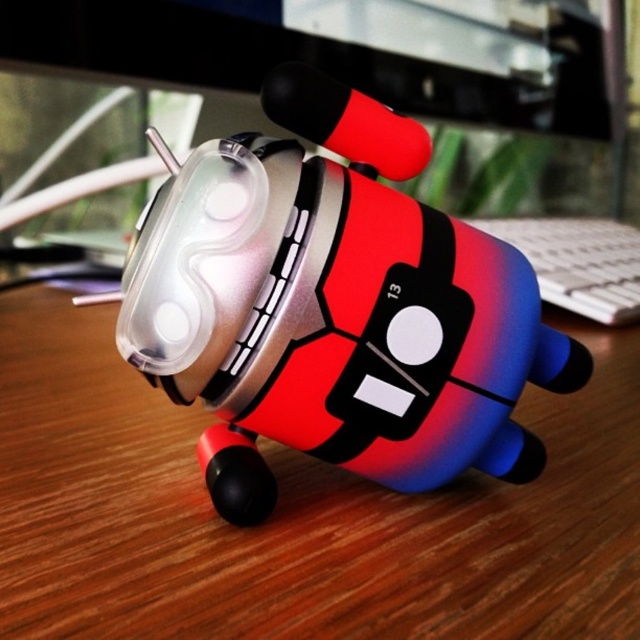
Question: Which object is positioned farthest from the gradient plastic toy at center?

Choices:
 (A) white plastic keyboard at center
 (B) wooden desk at center

Answer: (A)

Question: Is wooden desk at center smaller than gradient plastic toy at center?

Choices:
 (A) yes
 (B) no

Answer: (B)

Question: Which of these objects is positioned closest to the white plastic keyboard at center?

Choices:
 (A) wooden desk at center
 (B) gradient plastic toy at center

Answer: (A)

Question: Does gradient plastic toy at center appear over white plastic keyboard at center?

Choices:
 (A) no
 (B) yes

Answer: (A)

Question: Does wooden desk at center have a lesser width compared to gradient plastic toy at center?

Choices:
 (A) yes
 (B) no

Answer: (B)

Question: Which object appears farthest from the camera in this image?

Choices:
 (A) gradient plastic toy at center
 (B) white plastic keyboard at center
 (C) wooden desk at center

Answer: (B)